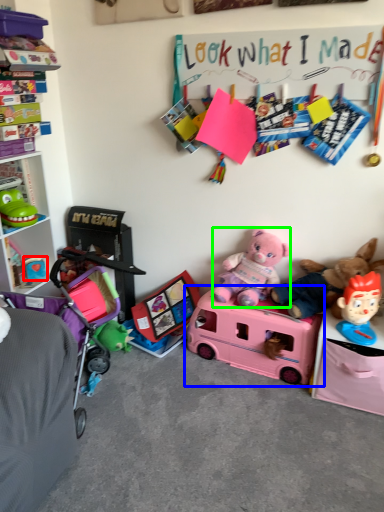
Question: Considering the real-world distances, which object is closest to toy (highlighted by a red box)? toy (highlighted by a blue box) or teddy bear (highlighted by a green box).

Choices:
 (A) toy
 (B) teddy bear

Answer: (B)